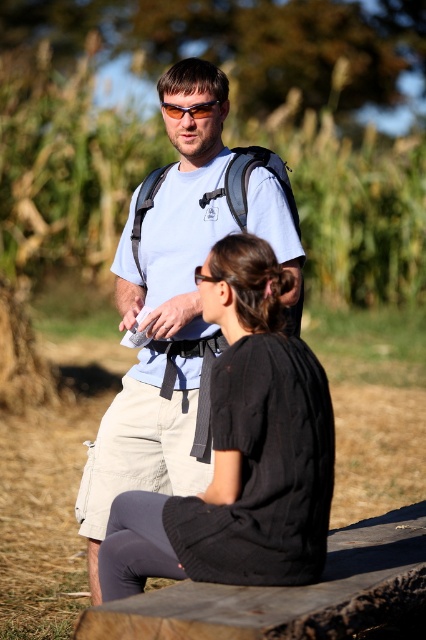
Question: Does black textured sweater at center have a lesser width compared to sunglasses at center?

Choices:
 (A) no
 (B) yes

Answer: (A)

Question: Which of the following is the closest to the observer?

Choices:
 (A) (298, 394)
 (B) (181, 115)

Answer: (A)

Question: Does black textured sweater at center have a greater width compared to sunglasses at center?

Choices:
 (A) no
 (B) yes

Answer: (B)

Question: Which point is farther to the camera?

Choices:
 (A) black textured sweater at center
 (B) sunglasses at center

Answer: (B)

Question: Observing the image, what is the correct spatial positioning of black textured sweater at center in reference to sunglasses at center?

Choices:
 (A) above
 (B) below

Answer: (B)